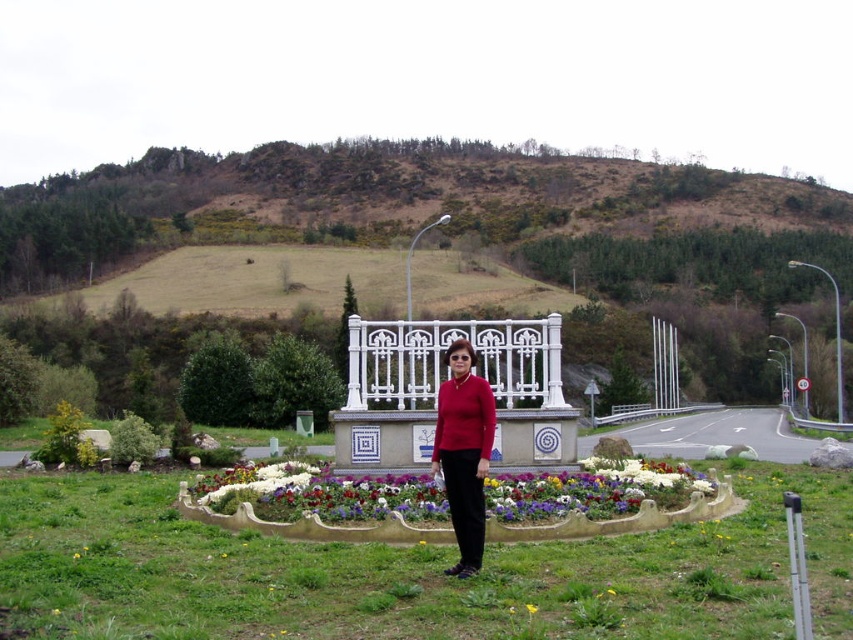
You are standing at the point marked as point (x=312, y=525) in the image. Based on the scene description, what surface are you currently standing on?

You are standing on the glossy concrete flower bed at center.

You are a photographer trying to capture the matte red sweater at center and the glossy concrete flower bed at center in the same frame. Based on their positions, which object should you adjust your camera focus to first to ensure both are in the shot?

Since the glossy concrete flower bed at center is to the right of the matte red sweater at center, you should focus on the matte red sweater at center first as it is closer to the camera, ensuring both objects remain in the frame when adjusting focus.